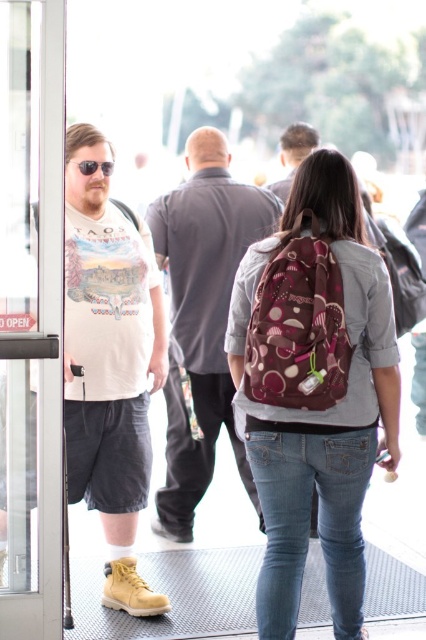
From the picture: Who is positioned more to the right, transparent glass door at left or black plastic sunglasses at left?

Positioned to the right is black plastic sunglasses at left.

Between transparent glass door at left and black plastic sunglasses at left, which one appears on the left side from the viewer's perspective?

transparent glass door at left is more to the left.

Does point (17, 330) come closer to viewer compared to point (85, 166)?

Yes, it is.

Where is `transparent glass door at left`? The image size is (426, 640). transparent glass door at left is located at coordinates (31, 314).

Who is positioned more to the left, brown fabric backpack at center or transparent glass door at left?

Positioned to the left is transparent glass door at left.

Describe the element at coordinates (313, 388) in the screenshot. Image resolution: width=426 pixels, height=640 pixels. I see `brown fabric backpack at center` at that location.

Locate an element on the screen. Image resolution: width=426 pixels, height=640 pixels. brown fabric backpack at center is located at coordinates (313, 388).

This screenshot has width=426, height=640. What are the coordinates of `brown fabric backpack at center` in the screenshot? It's located at (313, 388).

Who is more distant from viewer, (313, 444) or (279, 504)?

The point (279, 504) is behind.

I want to click on brown fabric backpack at center, so click(313, 388).

Image resolution: width=426 pixels, height=640 pixels. Find the location of `brown fabric backpack at center`. brown fabric backpack at center is located at coordinates (313, 388).